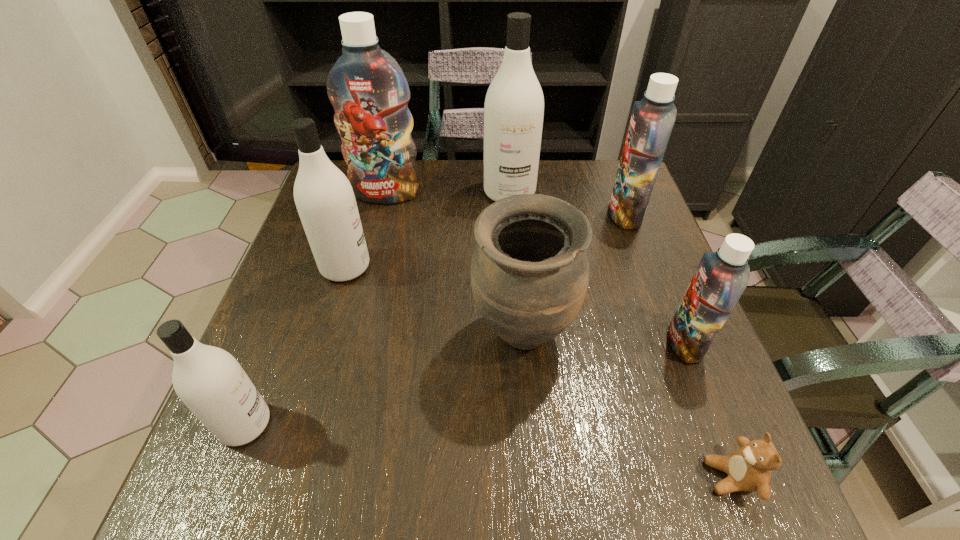
I want to click on free space located 0.110m on the front label of the nearest blue shampoo, so click(613, 343).

The image size is (960, 540). In order to click on vacant region located on the front label of the nearest blue shampoo in this screenshot , I will do `click(579, 343)`.

At what (x,y) coordinates should I click in order to perform the action: click on vacant region located 0.320m on the front-facing side of the smallest white shampoo. Please return your answer as a coordinate pair (x, y). This screenshot has height=540, width=960. Looking at the image, I should click on (455, 424).

Identify the location of vacant space located on the front-facing side of the teddy bear. (644, 477).

Locate an element on the screen. blank space located on the front-facing side of the teddy bear is located at coordinates (588, 477).

Where is `free space located 0.370m on the front-facing side of the teddy bear`? The image size is (960, 540). free space located 0.370m on the front-facing side of the teddy bear is located at coordinates [x=475, y=477].

In order to click on object that is at the near edge in this screenshot , I will do `click(749, 468)`.

Find the location of a particular element. The image size is (960, 540). teddy bear at the right edge is located at coordinates (749, 468).

Image resolution: width=960 pixels, height=540 pixels. What are the coordinates of `object present at the far left corner` in the screenshot? It's located at (369, 92).

The width and height of the screenshot is (960, 540). Find the location of `object present at the far right corner`. object present at the far right corner is located at coordinates click(x=652, y=120).